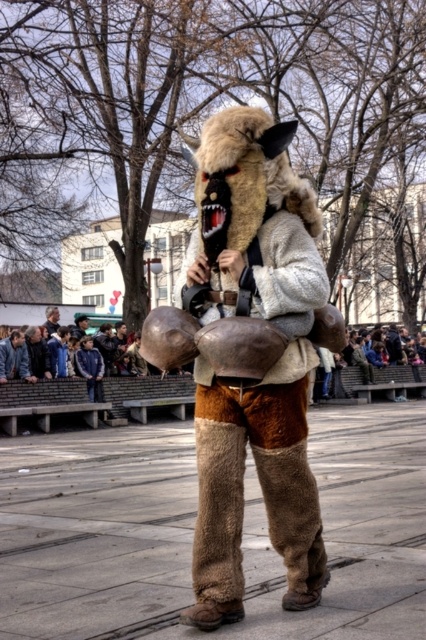
Question: In this image, where is furry costume at center located relative to dark gray fabric jacket at lower left?

Choices:
 (A) right
 (B) left

Answer: (A)

Question: Which of the following is the closest to the observer?

Choices:
 (A) dark gray fabric jacket at lower left
 (B) furry costume at center

Answer: (B)

Question: Which point is closer to the camera?

Choices:
 (A) (57, 310)
 (B) (278, 362)

Answer: (B)

Question: Does furry costume at center appear under dark gray fabric jacket at lower left?

Choices:
 (A) yes
 (B) no

Answer: (A)

Question: In this image, where is furry costume at center located relative to dark gray fabric jacket at lower left?

Choices:
 (A) below
 (B) above

Answer: (A)